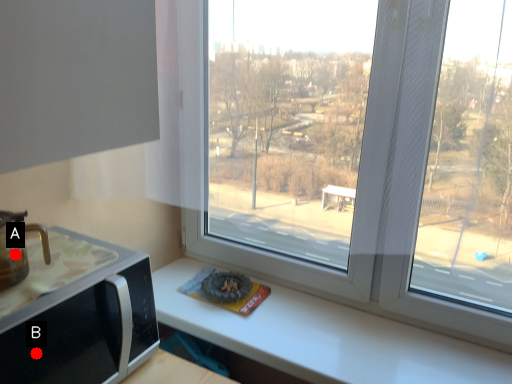
Question: Two points are circled on the image, labeled by A and B beside each circle. Which point is closer to the camera?

Choices:
 (A) A is closer
 (B) B is closer

Answer: (B)